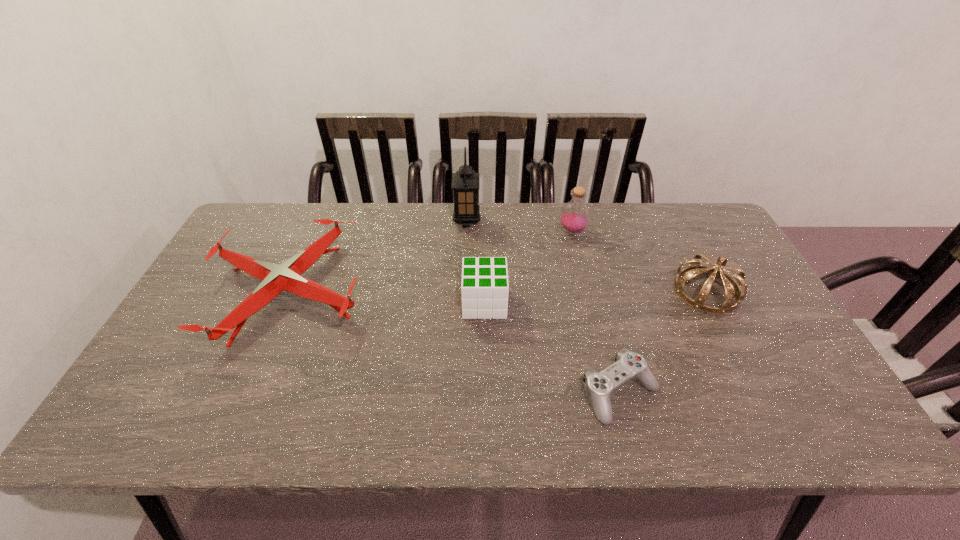
Find the location of a particular element. object that is at the left edge is located at coordinates (275, 278).

Image resolution: width=960 pixels, height=540 pixels. I want to click on object that is at the right edge, so click(x=731, y=285).

The height and width of the screenshot is (540, 960). I want to click on object present at the far left corner, so click(x=275, y=278).

In the image, there is a desktop. Where is `blank space at the far edge`? The height and width of the screenshot is (540, 960). blank space at the far edge is located at coordinates (409, 205).

I want to click on vacant space at the near edge of the desktop, so click(x=285, y=423).

Locate an element on the screen. The height and width of the screenshot is (540, 960). vacant space at the left edge of the desktop is located at coordinates (221, 280).

You are a GUI agent. You are given a task and a screenshot of the screen. Output one action in this format:
    pyautogui.click(x=<x>, y=<y>)
    Task: Click on the vacant area at the right edge of the desktop
    
    Given the screenshot: What is the action you would take?
    pyautogui.click(x=739, y=260)

You are a GUI agent. You are given a task and a screenshot of the screen. Output one action in this format:
    pyautogui.click(x=<x>, y=<y>)
    Task: Click on the free space at the far left corner
    Image resolution: width=960 pixels, height=540 pixels.
    Given the screenshot: What is the action you would take?
    pyautogui.click(x=286, y=233)

Where is `free space at the far right corner of the desktop`? This screenshot has height=540, width=960. free space at the far right corner of the desktop is located at coordinates (696, 227).

At what (x,y) coordinates should I click in order to perform the action: click on free point between the tiara and the lantern. Please return your answer as a coordinate pair (x, y). Looking at the image, I should click on (587, 256).